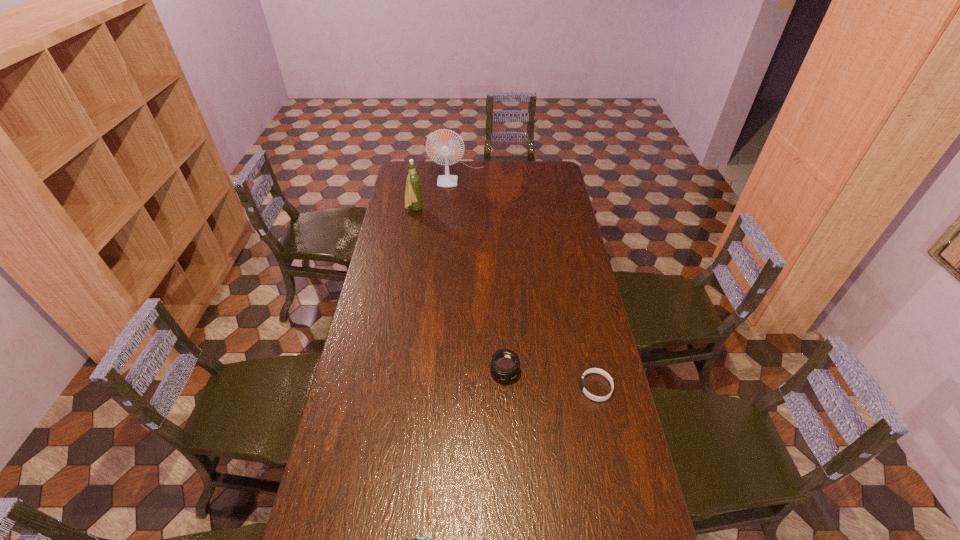
Find the location of a particular element. free space that satisfies the following two spatial constraints: 1. on the front-facing side of the fan; 2. on the front-facing side of the fourth shortest object is located at coordinates (455, 210).